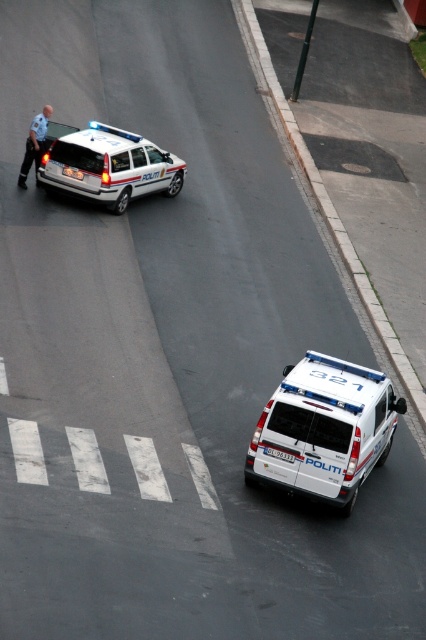
You are a pedestrian on the street and you see the light blue uniform at left and the white plastic license plate at center. Which object is larger?

The light blue uniform at left is bigger than the white plastic license plate at center.

You are a pedestrian standing at the point with coordinates point [117,147]. You want to cross the street to reach the point with coordinates point [307,397]. Given the presence of the police vehicles, is the path between these two points clear of any obstacles?

The path between point [117,147] and point [307,397] is clear because point [307,397] is in front of point [117,147], indicating no obstacles are blocking the way.